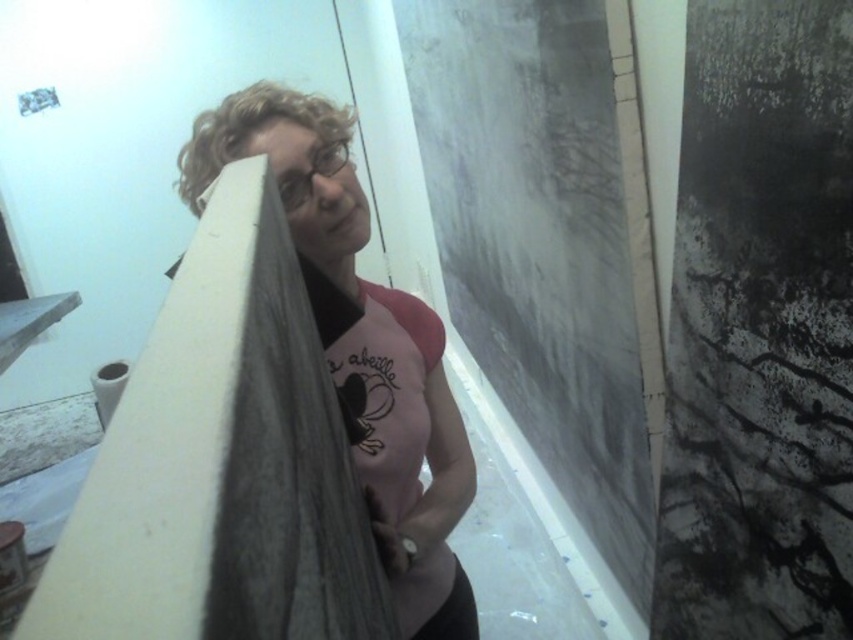
Question: Can you confirm if matte gray fabric at center is positioned to the right of curly blonde hair at upper left?

Choices:
 (A) yes
 (B) no

Answer: (A)

Question: Can you confirm if matte gray fabric at center is bigger than curly blonde hair at upper left?

Choices:
 (A) yes
 (B) no

Answer: (A)

Question: Which point appears farthest from the camera in this image?

Choices:
 (A) (312, 128)
 (B) (270, 125)

Answer: (A)

Question: Is matte gray fabric at center thinner than curly blonde hair at upper left?

Choices:
 (A) yes
 (B) no

Answer: (B)

Question: Which point is closer to the camera taking this photo?

Choices:
 (A) (328, 294)
 (B) (329, 150)

Answer: (A)

Question: Among these points, which one is nearest to the camera?

Choices:
 (A) (254, 86)
 (B) (439, 627)

Answer: (A)